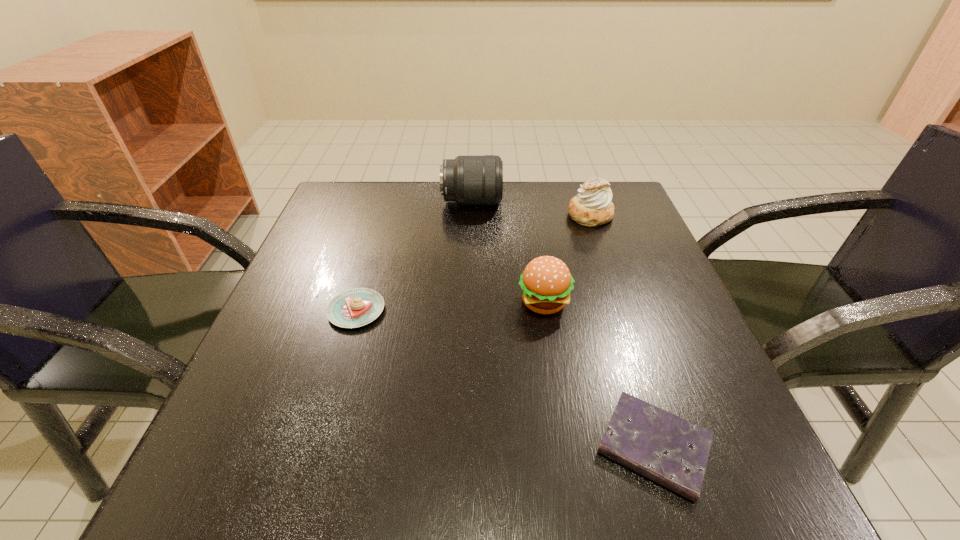
Locate an element on the screen. The image size is (960, 540). object that is at the far right corner is located at coordinates (592, 207).

Identify the location of object that is positioned at the near right corner. (667, 449).

Locate an element on the screen. Image resolution: width=960 pixels, height=540 pixels. free location at the far edge is located at coordinates (391, 224).

At what (x,y) coordinates should I click in order to perform the action: click on vacant region at the near edge of the desktop. Please return your answer as a coordinate pair (x, y). Looking at the image, I should click on (436, 446).

You are a GUI agent. You are given a task and a screenshot of the screen. Output one action in this format:
    pyautogui.click(x=<x>, y=<y>)
    Task: Click on the free spot at the left edge of the desktop
    The image size is (960, 540).
    Given the screenshot: What is the action you would take?
    pyautogui.click(x=268, y=439)

The image size is (960, 540). In order to click on blank space at the right edge of the desktop in this screenshot , I will do `click(742, 429)`.

The width and height of the screenshot is (960, 540). In the image, there is a desktop. Find the location of `free space at the far left corner`. free space at the far left corner is located at coordinates (384, 231).

At what (x,y) coordinates should I click in order to perform the action: click on blank area at the far right corner. Please return your answer as a coordinate pair (x, y). Looking at the image, I should click on (616, 181).

Identify the location of vacant space at the near right corner. (716, 458).

Identify the location of unoccupied position between the hamburger and the left pastry. This screenshot has width=960, height=540. (450, 306).